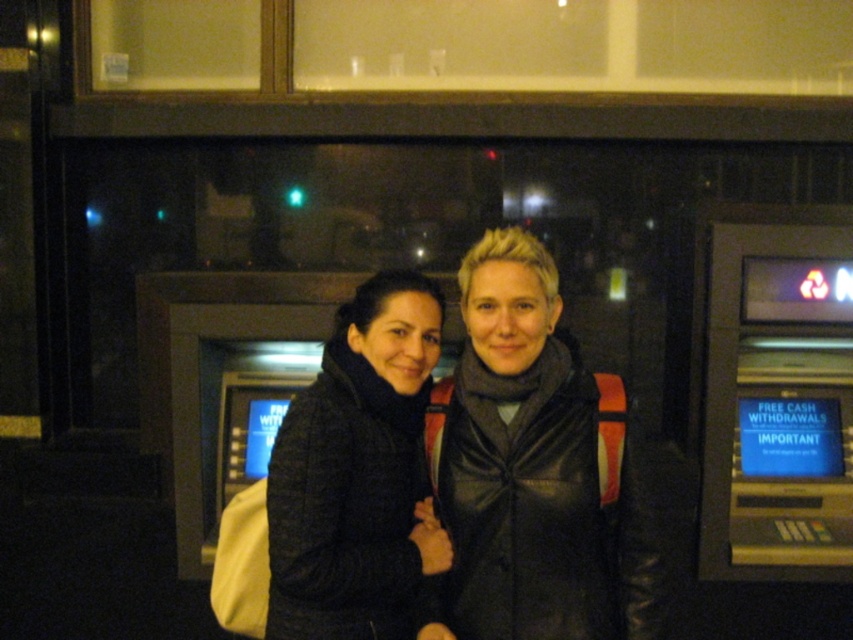
Question: Which object is farther from the camera taking this photo?

Choices:
 (A) black fuzzy coat at center
 (B) metallic gray slot machine at right
 (C) dark gray leather jacket at center

Answer: (B)

Question: Based on their relative distances, which object is nearer to the black fuzzy coat at center?

Choices:
 (A) metallic gray slot machine at right
 (B) dark gray leather jacket at center

Answer: (B)

Question: Is dark gray leather jacket at center above metallic gray slot machine at right?

Choices:
 (A) yes
 (B) no

Answer: (B)

Question: Is dark gray leather jacket at center below metallic gray slot machine at right?

Choices:
 (A) no
 (B) yes

Answer: (B)

Question: Is the position of dark gray leather jacket at center more distant than that of metallic gray slot machine at right?

Choices:
 (A) no
 (B) yes

Answer: (A)

Question: Estimate the real-world distances between objects in this image. Which object is closer to the black fuzzy coat at center?

Choices:
 (A) dark gray leather jacket at center
 (B) metallic gray slot machine at right

Answer: (A)